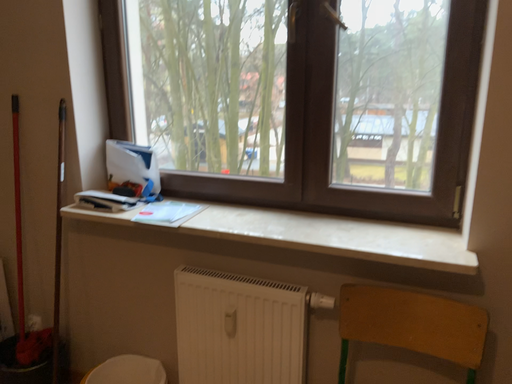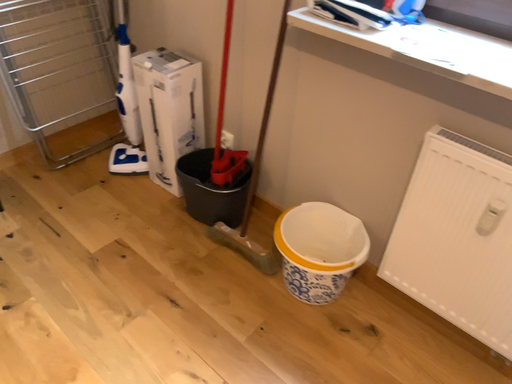
Question: How did the camera likely rotate when shooting the video?

Choices:
 (A) rotated downward
 (B) rotated upward

Answer: (A)